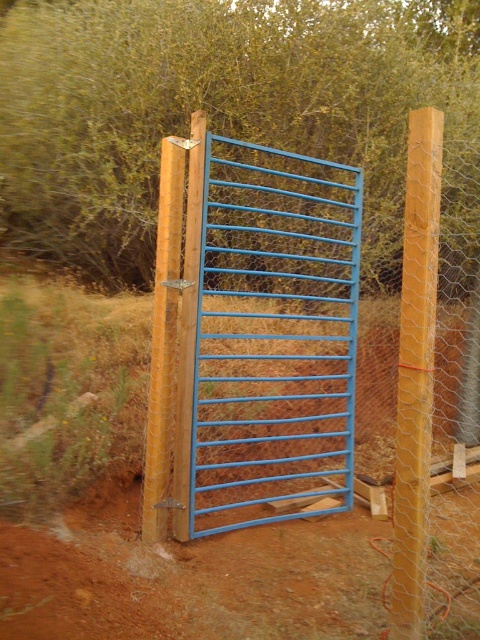
You are a farmer who needs to drive a tractor through the dirt field at center and the blue painted metal gate at center. Based on their widths, which one can accommodate the tractor more easily?

The dirt field at center is wider than the blue painted metal gate at center, so the tractor can pass through the dirt field at center more easily.

You are standing at the entrance of the gate and want to walk to the dirt field at center. Which direction should you go relative to the blue painted metal gate at center?

The dirt field at center is positioned on the left side of blue painted metal gate at center, so you should go to the left side of the blue painted metal gate at center to reach the dirt field at center.

You are standing at the entrance of the gate and want to walk to the dirt field at center. In which direction should you go?

The dirt field at center is located at point [139,502], so you should go forward through the partially open gate to reach it.